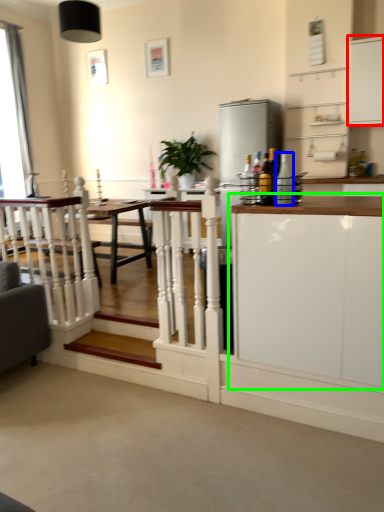
Question: Which is farther away from cabinetry (highlighted by a red box)? bottle (highlighted by a blue box) or cabinetry (highlighted by a green box)?

Choices:
 (A) bottle
 (B) cabinetry

Answer: (B)